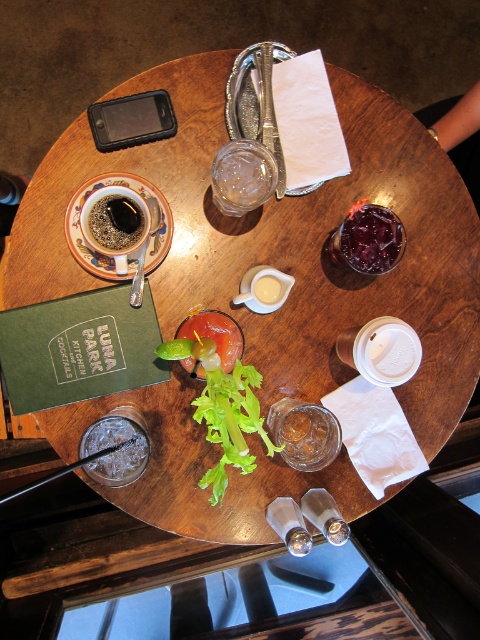
You are a photographer trying to capture the scene from the camera position. If you focus on point [78,227], will point [96,211] also be in focus? Explain your answer using the depth of field concept.

Since point [78,227] is closer to the camera than point [96,211], focusing on the closer point may leave the farther point out of focus depending on the depth of field. A shallow depth of field would blur the background, so point [96,211] might not be in focus.

You are a barista trying to clean the table. You see the matte ceramic cup at upper left and the matte black coffee cup at upper left. Which cup is closer to the edge of the table?

The matte black coffee cup at upper left is closer to the edge of the table because the matte ceramic cup at upper left is positioned under it, meaning the black cup is on top and likely placed further outward.